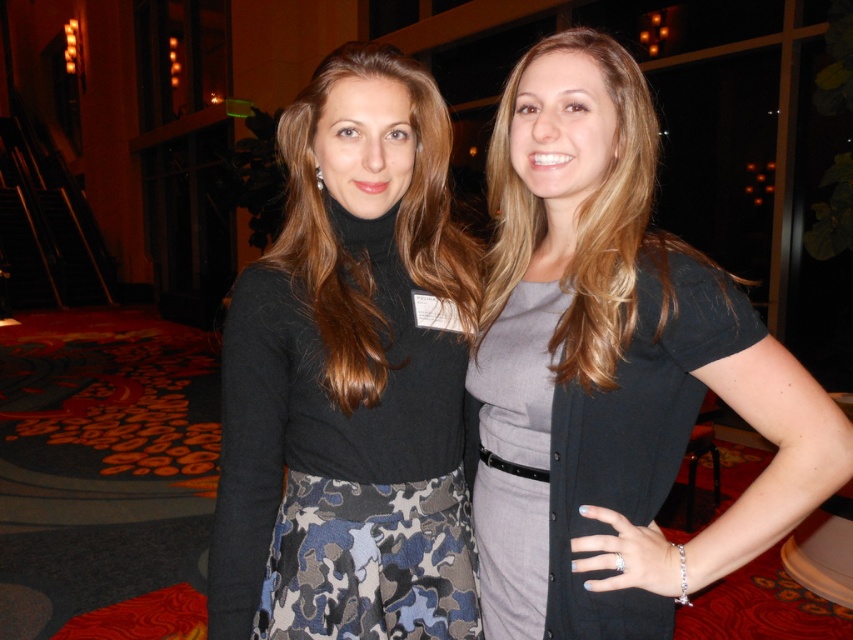
Question: Among these points, which one is nearest to the camera?

Choices:
 (A) (643, 390)
 (B) (416, 630)
 (C) (581, 262)

Answer: (A)

Question: Can you confirm if gray matte dress at center is wider than matte gray dress at center?

Choices:
 (A) no
 (B) yes

Answer: (A)

Question: Is gray matte dress at center below matte gray dress at center?

Choices:
 (A) no
 (B) yes

Answer: (B)

Question: Which point appears farthest from the camera in this image?

Choices:
 (A) (509, 289)
 (B) (627, 472)
 (C) (439, 344)

Answer: (A)

Question: Which point is farther to the camera?

Choices:
 (A) gray matte dress at center
 (B) matte gray dress at center

Answer: (B)

Question: Considering the relative positions of matte black turtleneck sweater at center and gray matte dress at center in the image provided, where is matte black turtleneck sweater at center located with respect to gray matte dress at center?

Choices:
 (A) above
 (B) below

Answer: (A)